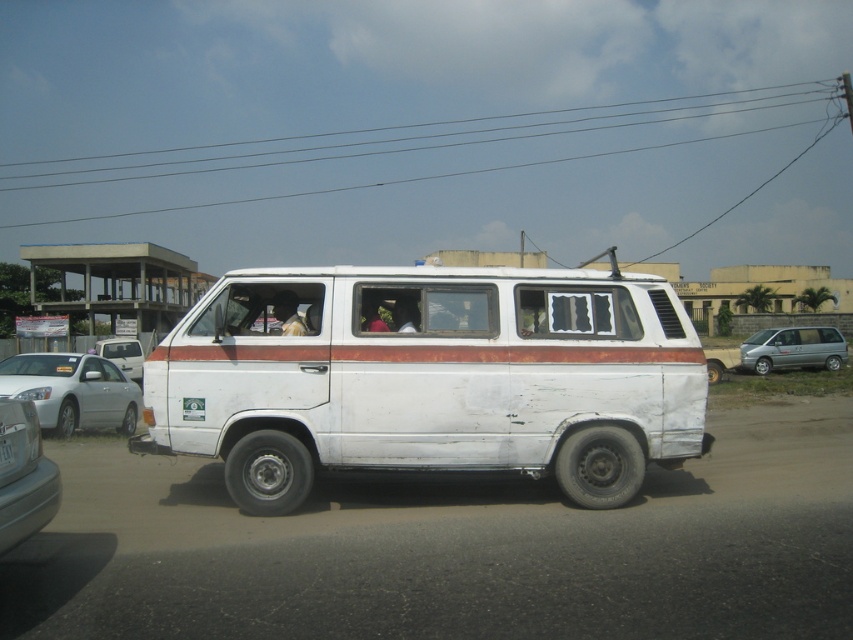
Question: Which is farther from the white plastic license plate at center?

Choices:
 (A) white matte van at left
 (B) silver metallic minivan at right
 (C) silver metallic sedan at left

Answer: (B)

Question: Is silver metallic sedan at left closer to camera compared to white plastic license plate at center?

Choices:
 (A) yes
 (B) no

Answer: (B)

Question: Which object appears closest to the camera in this image?

Choices:
 (A) metallic wires at upper center
 (B) silver metallic sedan at left
 (C) silver metallic minivan at right
 (D) white matte van at center

Answer: (D)

Question: Is silver metallic sedan at left further to the viewer compared to metallic silver car at lower left?

Choices:
 (A) no
 (B) yes

Answer: (B)

Question: Among these points, which one is farthest from the camera?

Choices:
 (A) (4, 448)
 (B) (242, 369)

Answer: (B)

Question: Is silver metallic minivan at right in front of white plastic license plate at center?

Choices:
 (A) yes
 (B) no

Answer: (B)